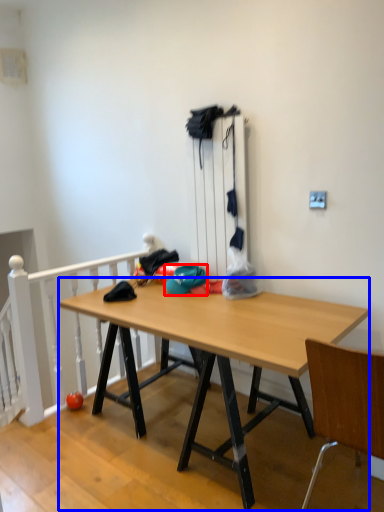
Question: Among these objects, which one is nearest to the camera, hat (highlighted by a red box) or desk (highlighted by a blue box)?

Choices:
 (A) hat
 (B) desk

Answer: (B)